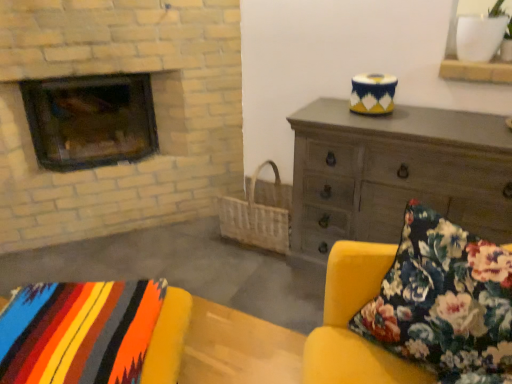
The height and width of the screenshot is (384, 512). Identify the location of empty space that is ontop of multicolored woven blanket at lower left. (80, 325).